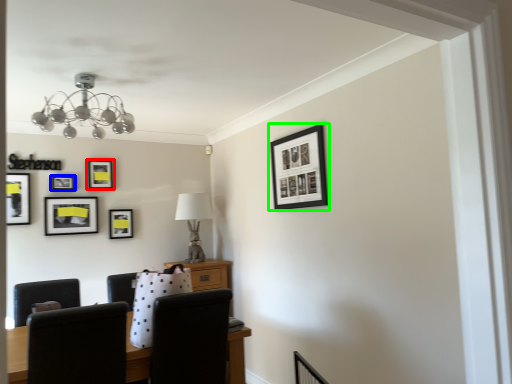
Question: Which is farther away from picture frame (highlighted by a red box)? picture frame (highlighted by a blue box) or picture frame (highlighted by a green box)?

Choices:
 (A) picture frame
 (B) picture frame

Answer: (B)